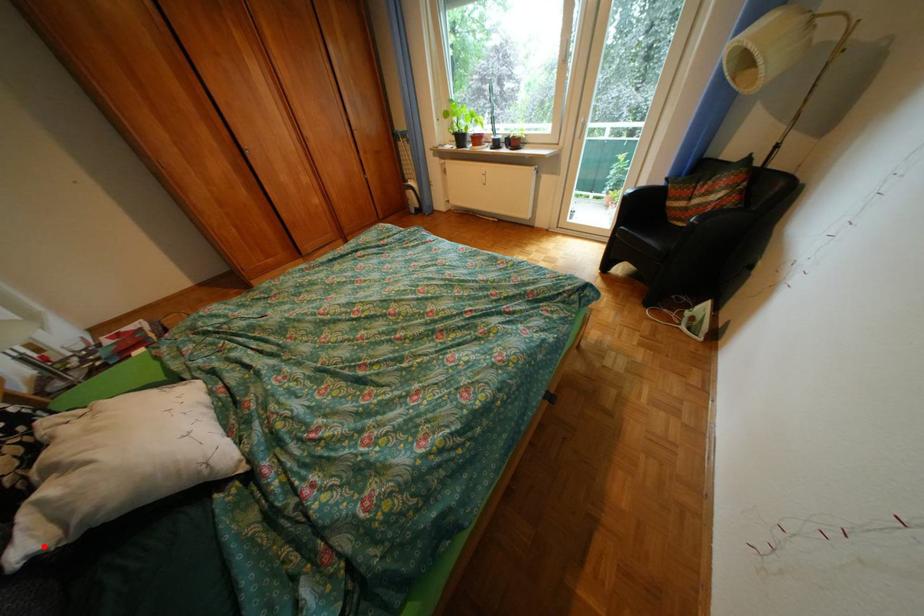
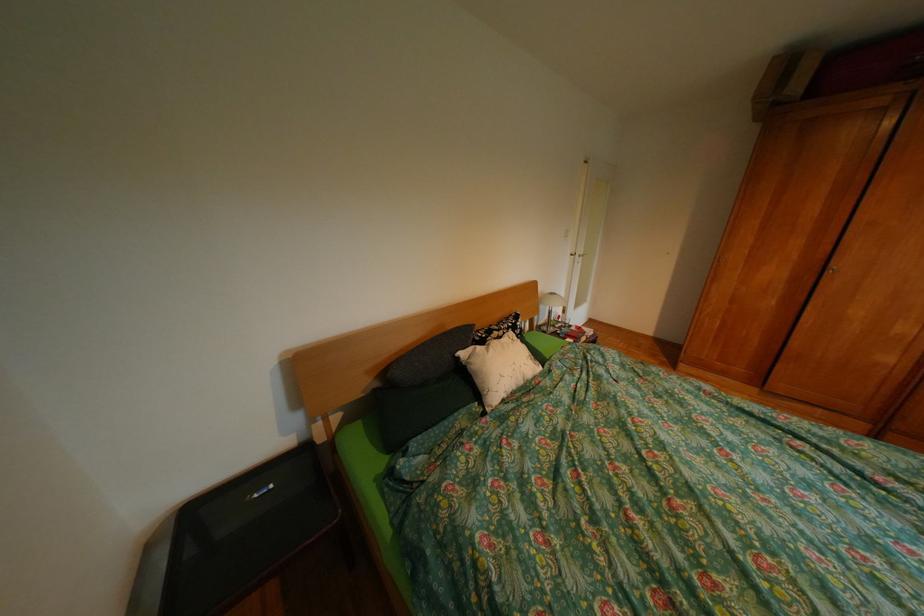
Question: I am providing you with two images of the same scene from different viewpoints. Given a red point in image1, look at the same physical point in image2. Is it:

Choices:
 (A) Closer to the viewpoint
 (B) Farther from the viewpoint

Answer: (A)